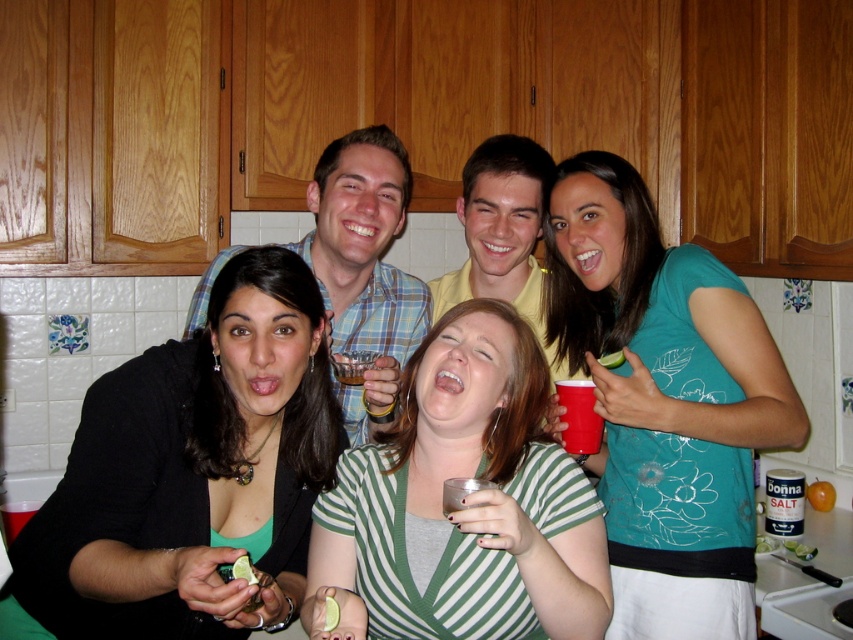
You are standing in the kitchen and want to hand a drink to the person wearing the plaid shirt at center. Since you are facing the group, should you move to your left or right to reach them first compared to the yellow cotton shirt at center?

The plaid shirt at center is to the left of yellow cotton shirt at center. Since you are facing the group, the person wearing the plaid shirt at center is on your right side. Therefore, to reach them first, you should move to your right.